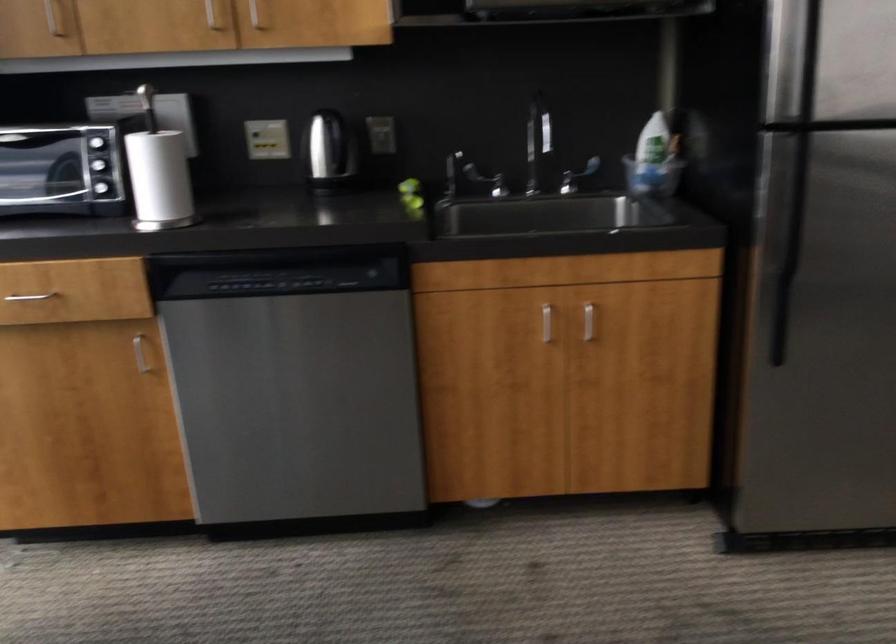
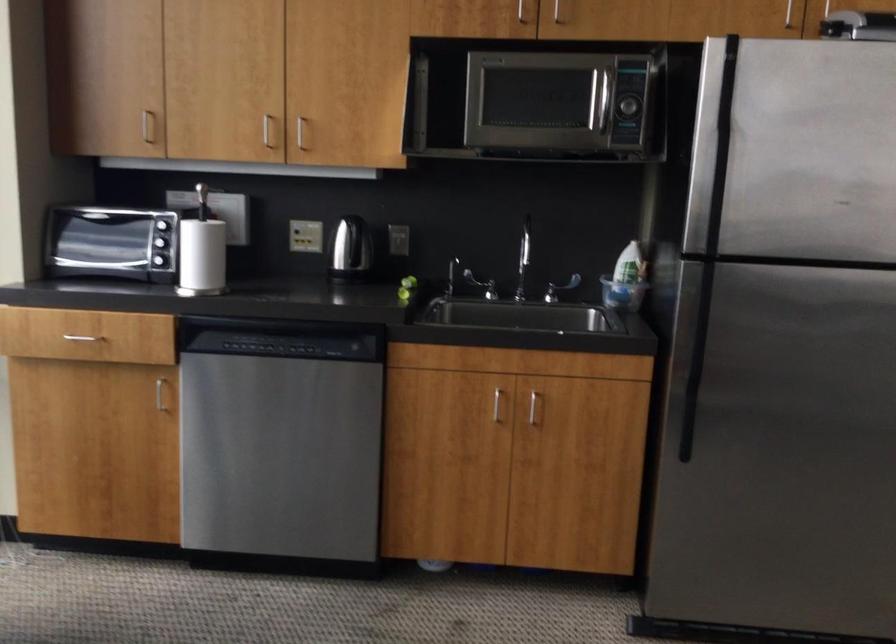
The point at (107,194) is marked in the first image. Where is the corresponding point in the second image?

(159, 263)